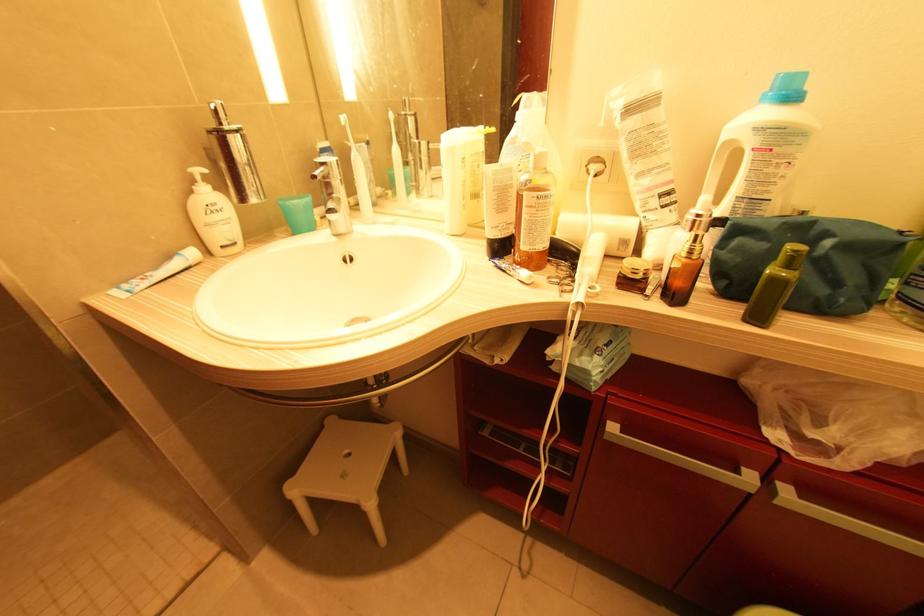
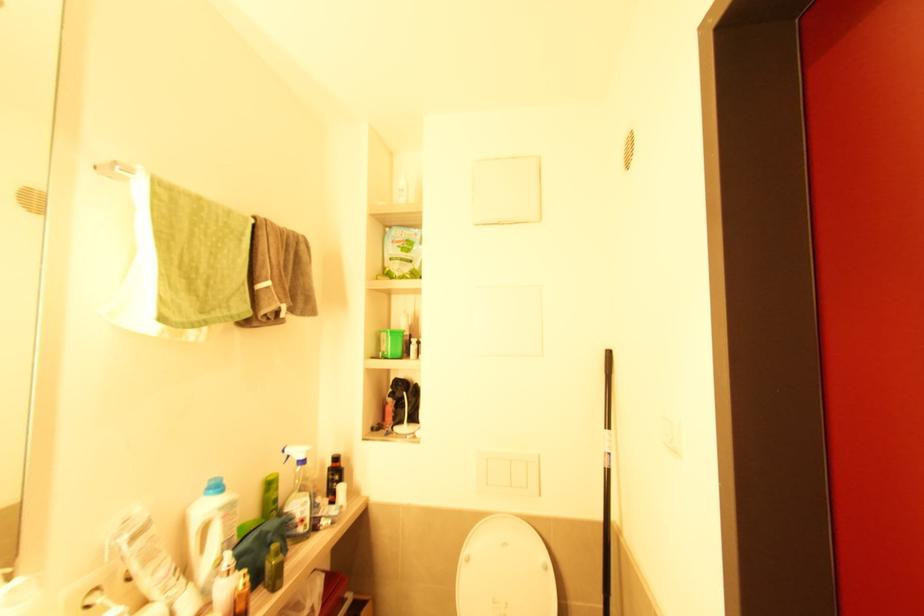
Where in the second image is the point corresponding to (x=690, y=254) from the first image?

(247, 585)